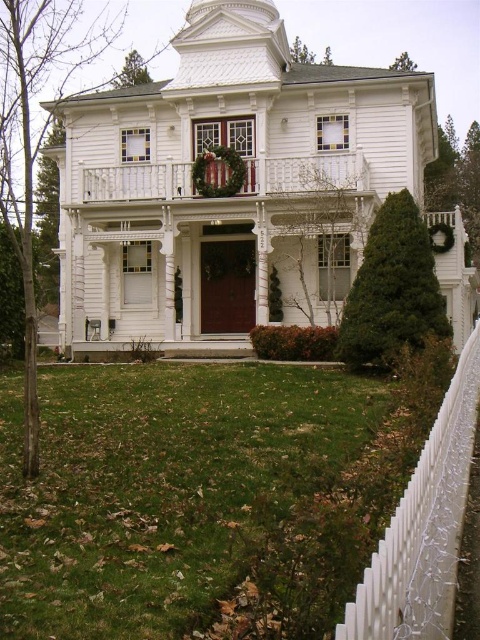
You are a gardener planning to mow the lawn around the white picket fence at right and the green grass at lower left. Which area requires less effort due to its size?

The green grass at lower left requires less effort because it has a smaller size compared to the white picket fence at right.

You are a painter hired to paint the white picket fence at right and the white wooden porch at upper center. You need to know which one requires a ladder to reach its top. Based on the scene, which one needs a ladder?

The white picket fence at right is taller than the white wooden porch at upper center, so you will need a ladder to paint the white picket fence at right.

You are a gardener who needs to install a new sprinkler system between the green grass at lower left and the white picket fence at right. The sprinkler system requires a minimum of 20 feet of space to function properly. Based on the scene, can you confirm whether there is enough space between these two objects to install the sprinkler system?

The green grass at lower left and the white picket fence at right are 20.16 feet apart from each other, which exceeds the minimum requirement of 20 feet. Therefore, there is sufficient space to install the sprinkler system between them.